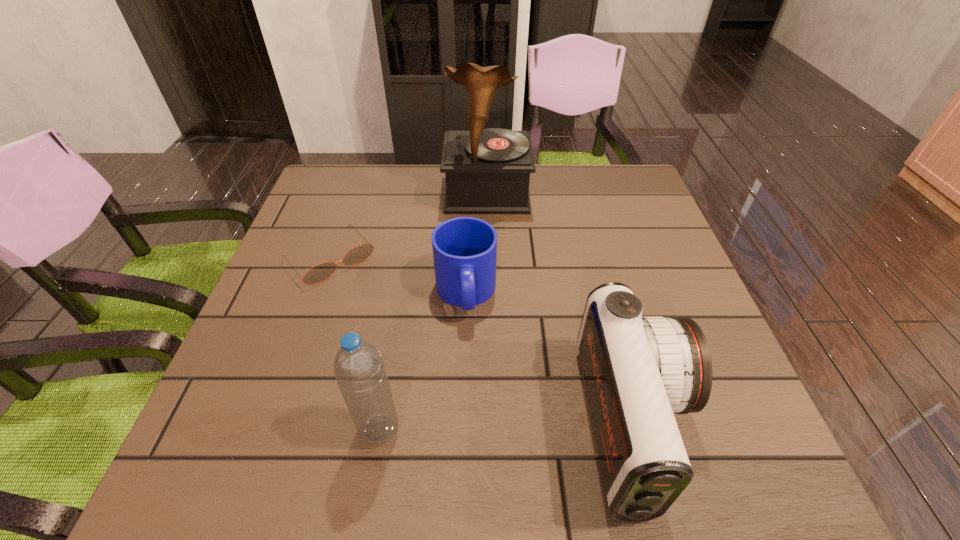
You are a GUI agent. You are given a task and a screenshot of the screen. Output one action in this format:
    pyautogui.click(x=<x>, y=<y>)
    Task: Click on the vacant space located 0.110m on the surface of the camcorder
    Image resolution: width=960 pixels, height=540 pixels.
    Given the screenshot: What is the action you would take?
    pyautogui.click(x=745, y=424)

Find the location of a particular element. The width and height of the screenshot is (960, 540). vacant region located on the face of the shortest object is located at coordinates (428, 367).

At what (x,y) coordinates should I click in order to perform the action: click on free space located on the face of the shortest object. Please return your answer as a coordinate pair (x, y). Image resolution: width=960 pixels, height=540 pixels. Looking at the image, I should click on (374, 307).

Find the location of a particular element. The height and width of the screenshot is (540, 960). free spot located 0.140m on the face of the shortest object is located at coordinates (384, 318).

You are a GUI agent. You are given a task and a screenshot of the screen. Output one action in this format:
    pyautogui.click(x=<x>, y=<y>)
    Task: Click on the vacant point located at the horn opening of the phonograph_record
    
    Given the screenshot: What is the action you would take?
    pyautogui.click(x=489, y=322)

This screenshot has width=960, height=540. Find the location of `vacant position located at the horn opening of the phonograph_record`. vacant position located at the horn opening of the phonograph_record is located at coordinates (488, 237).

Where is `vacant space located 0.380m at the horn opening of the phonograph_record`? Image resolution: width=960 pixels, height=540 pixels. vacant space located 0.380m at the horn opening of the phonograph_record is located at coordinates (489, 326).

The image size is (960, 540). Identify the location of vacant space located on the side with the handle of the second shortest object. (470, 368).

Locate an element on the screen. The width and height of the screenshot is (960, 540). vacant space positioned on the side with the handle of the second shortest object is located at coordinates (469, 355).

Find the location of a particular element. This screenshot has width=960, height=540. object at the far edge is located at coordinates (487, 171).